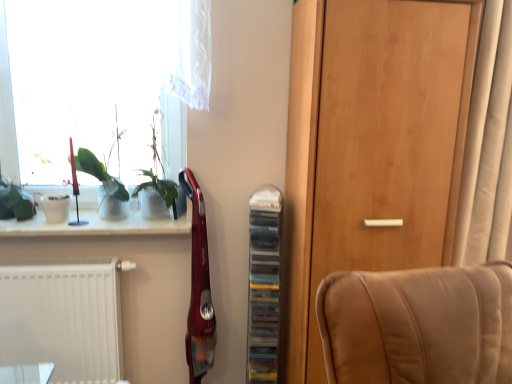
Question: Is wooden door at center in front of or behind beige fabric curtain at right in the image?

Choices:
 (A) behind
 (B) front

Answer: (B)

Question: From a real-world perspective, is wooden door at center physically located above or below beige fabric curtain at right?

Choices:
 (A) below
 (B) above

Answer: (A)

Question: Which is farther from the wooden door at center?

Choices:
 (A) white matte radiator at lower left
 (B) white glossy window sill at upper left
 (C) green leafy plant at upper left
 (D) green matte plant at left
 (E) beige fabric curtain at right

Answer: (A)

Question: Which of these objects is positioned closest to the wooden door at center?

Choices:
 (A) beige fabric curtain at right
 (B) green leafy plant at upper left
 (C) transparent glass window at upper left
 (D) clear plastic shelf at center
 (E) white matte radiator at lower left

Answer: (A)